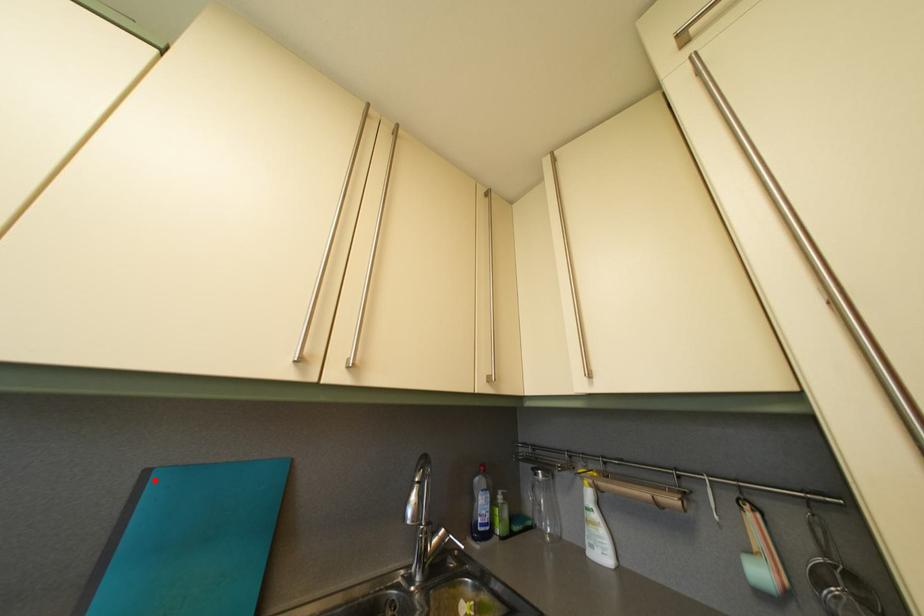
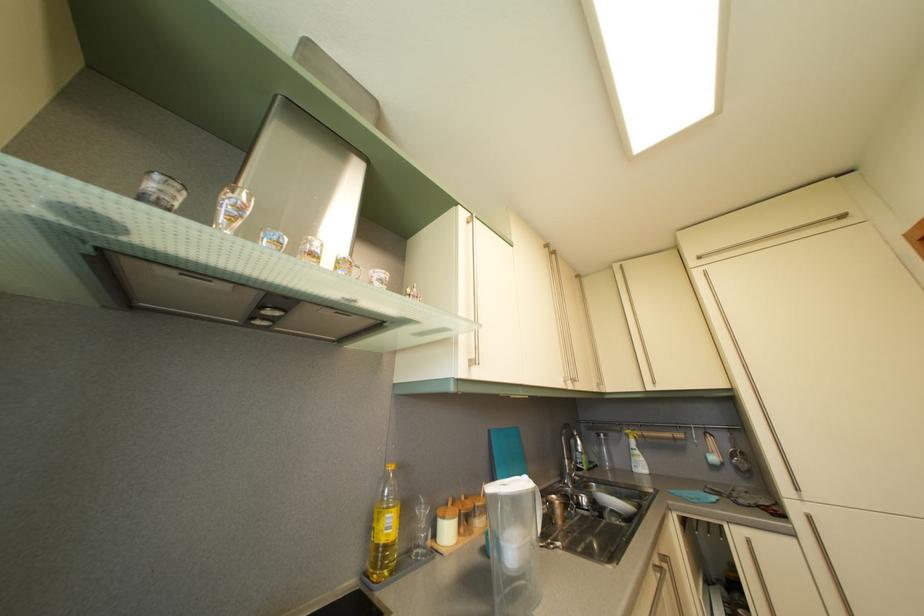
Question: A red point is marked in image1. In image2, is the corresponding 3D point closer to the camera or farther? Reply with the corresponding letter.

Choices:
 (A) The corresponding 3D point is closer.
 (B) The corresponding 3D point is farther.

Answer: (B)